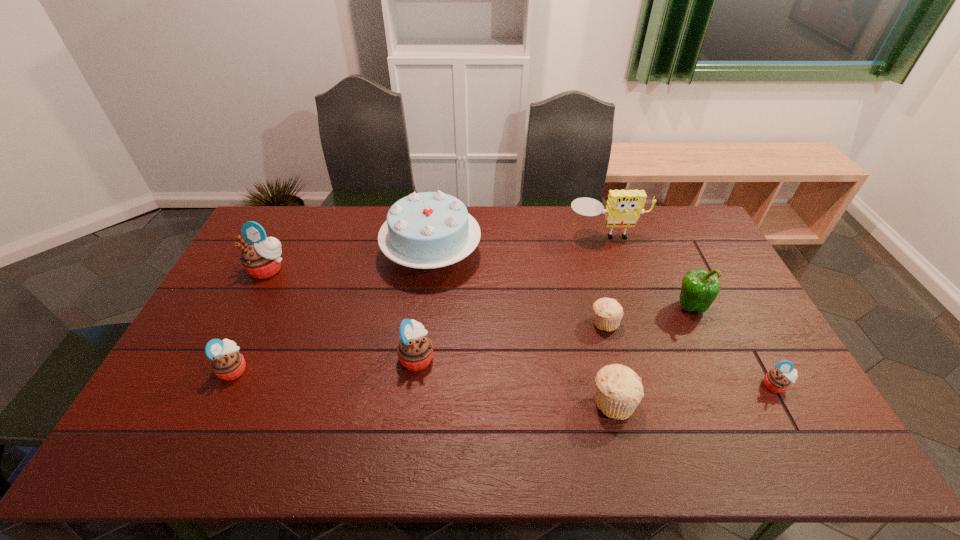
In the image, there is a desktop. At what (x,y) coordinates should I click in order to perform the action: click on vacant space at the far left corner. Please return your answer as a coordinate pair (x, y). The width and height of the screenshot is (960, 540). Looking at the image, I should click on (284, 223).

You are a GUI agent. You are given a task and a screenshot of the screen. Output one action in this format:
    pyautogui.click(x=<x>, y=<y>)
    Task: Click on the vacant space at the near left corner
    
    Given the screenshot: What is the action you would take?
    pyautogui.click(x=192, y=450)

Image resolution: width=960 pixels, height=540 pixels. I want to click on free space at the near right corner of the desktop, so click(804, 443).

Where is `vacant area that lies between the second farthest muffin and the fourth muffin from right to left`? vacant area that lies between the second farthest muffin and the fourth muffin from right to left is located at coordinates (511, 340).

Where is `empty location between the second smallest pink muffin and the third pink muffin from left to right`? Image resolution: width=960 pixels, height=540 pixels. empty location between the second smallest pink muffin and the third pink muffin from left to right is located at coordinates (325, 363).

You are a GUI agent. You are given a task and a screenshot of the screen. Output one action in this format:
    pyautogui.click(x=<x>, y=<y>)
    Task: Click on the free point between the biggest pink muffin and the rightmost muffin
    
    Given the screenshot: What is the action you would take?
    pyautogui.click(x=522, y=327)

Find the location of a particular element. Image resolution: width=960 pixels, height=540 pixels. free spot between the blue birthday cake and the second pink muffin from right to left is located at coordinates (424, 305).

Identify the location of unoccupied area between the third muffin from left to right and the sponge. (512, 296).

The height and width of the screenshot is (540, 960). I want to click on vacant area that lies between the blue birthday cake and the fifth nearest muffin, so (x=518, y=288).

In order to click on vacant point located between the sponge and the fifth nearest muffin in this screenshot , I will do `click(605, 279)`.